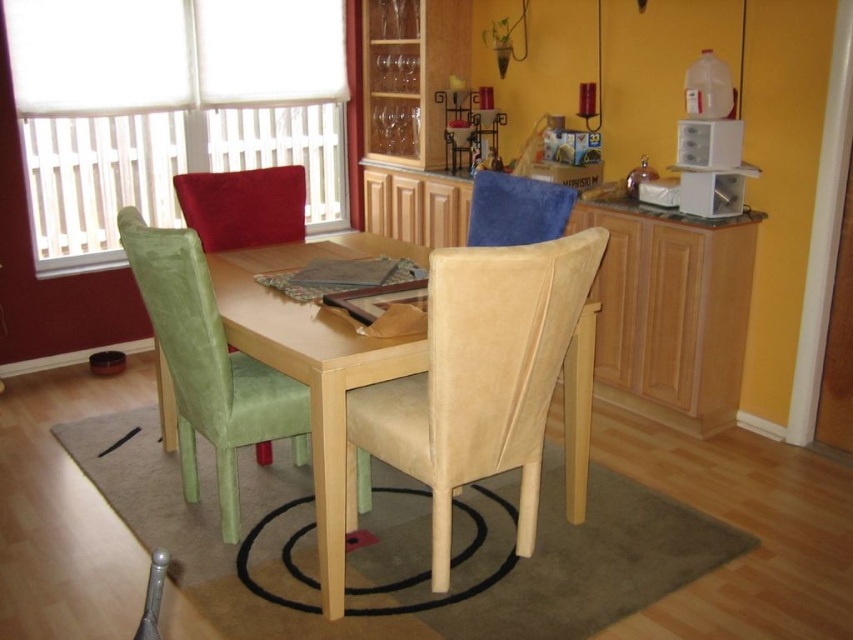
Locate an element on the screen. The height and width of the screenshot is (640, 853). green fabric chair at left is located at coordinates (207, 364).

Describe the element at coordinates (207, 364) in the screenshot. Image resolution: width=853 pixels, height=640 pixels. I see `green fabric chair at left` at that location.

The image size is (853, 640). Describe the element at coordinates (207, 364) in the screenshot. I see `green fabric chair at left` at that location.

Locate an element on the screen. This screenshot has width=853, height=640. green fabric chair at left is located at coordinates (207, 364).

Consider the image. Can you confirm if white matte window at upper left is thinner than blue fabric chair at upper center?

Incorrect, white matte window at upper left's width is not less than blue fabric chair at upper center's.

Is white matte window at upper left wider than blue fabric chair at upper center?

Indeed, white matte window at upper left has a greater width compared to blue fabric chair at upper center.

Is point (90, 209) positioned behind point (477, 195)?

That is True.

Where is `white matte window at upper left`? white matte window at upper left is located at coordinates (155, 100).

Is the position of green fabric chair at left less distant than that of gray fabric at center?

Yes, it is.

Does green fabric chair at left have a larger size compared to gray fabric at center?

Yes.

Between point (181, 378) and point (344, 268), which one is positioned in front?

Point (181, 378) is in front.

Find the location of `green fabric chair at left`. green fabric chair at left is located at coordinates (207, 364).